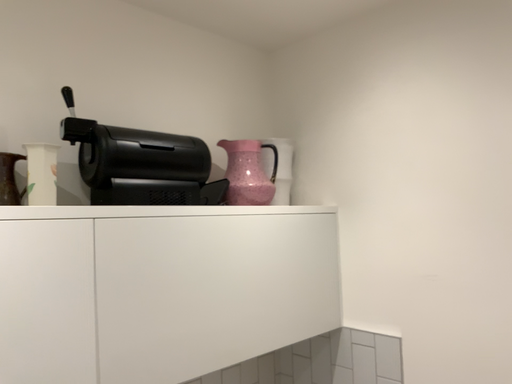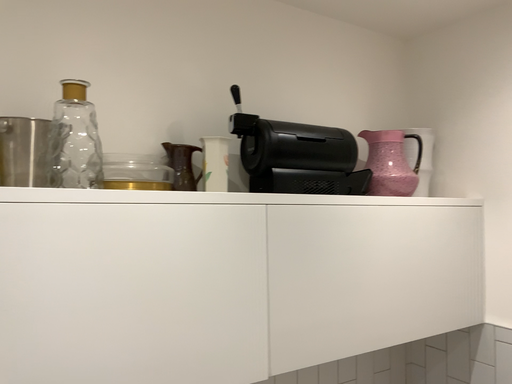
Question: How did the camera likely rotate when shooting the video?

Choices:
 (A) rotated left
 (B) rotated right

Answer: (A)